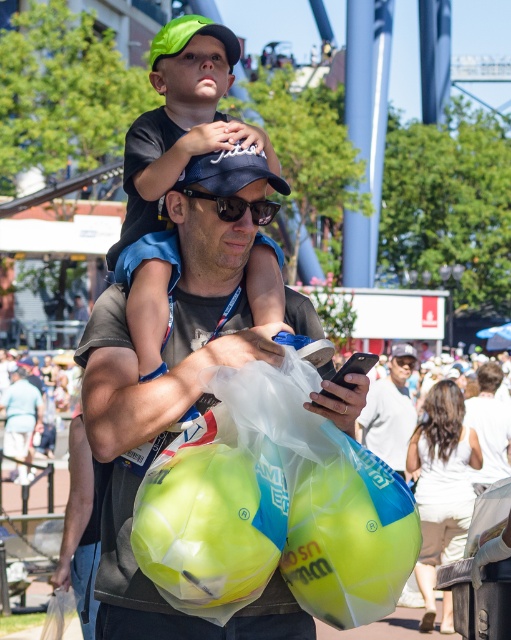
Can you confirm if green matte cap at center is shorter than matte black phone at center?

Incorrect, green matte cap at center's height does not fall short of matte black phone at center's.

Is green matte cap at center below matte black phone at center?

Incorrect, green matte cap at center is not positioned below matte black phone at center.

Identify the location of green matte cap at center. (181, 116).

This screenshot has height=640, width=511. What are the coordinates of `green matte cap at center` in the screenshot? It's located at [x=181, y=116].

Does translucent yellow beach ball at center have a lesser height compared to matte blue baseball cap at center?

No.

Can you confirm if translucent yellow beach ball at center is positioned to the left of matte blue baseball cap at center?

Correct, you'll find translucent yellow beach ball at center to the left of matte blue baseball cap at center.

Describe the element at coordinates (210, 524) in the screenshot. I see `translucent yellow beach ball at center` at that location.

Locate an element on the screen. The height and width of the screenshot is (640, 511). translucent yellow beach ball at center is located at coordinates (210, 524).

Who is shorter, translucent yellow beach ball at center or matte black phone at center?

translucent yellow beach ball at center

The height and width of the screenshot is (640, 511). What do you see at coordinates (210, 524) in the screenshot? I see `translucent yellow beach ball at center` at bounding box center [210, 524].

The image size is (511, 640). In order to click on translucent yellow beach ball at center in this screenshot , I will do `click(210, 524)`.